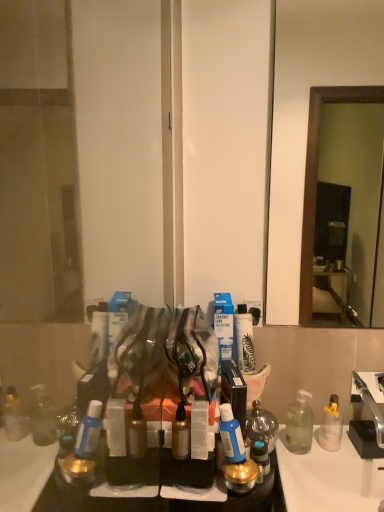
In order to face metallic gold toiletry at center, the 2th toiletry from the right, should I rotate leftwards or rightwards?

Turn right approximately 6.370 degrees to face it.

At what (x,y) coordinates should I click in order to perform the action: click on metallic gold spray can at center, the 1th toiletry from the left. Please return your answer as a coordinate pair (x, y). The width and height of the screenshot is (384, 512). Looking at the image, I should click on (180, 434).

Measure the distance between point (177, 443) and camera.

Point (177, 443) and camera are 95.40 centimeters apart from each other.

Find the location of a particular element. translucent glass jar at center, the 5th toiletry from the left is located at coordinates (262, 425).

Describe the element at coordinates (231, 435) in the screenshot. I see `blue glossy bottle at center, the third toiletry viewed from the left` at that location.

You are a GUI agent. You are given a task and a screenshot of the screen. Output one action in this format:
    pyautogui.click(x=<x>, y=<y>)
    Task: Click on the metallic gold toiletry at center, which is the 4th toiletry from left to right
    This screenshot has width=384, height=512.
    Given the screenshot: What is the action you would take?
    pyautogui.click(x=235, y=454)

Is blue glossy bottle at center, the 3th toiletry from the right, facing away from translucent glass jar at center, the 5th toiletry from the left?

blue glossy bottle at center, the 3th toiletry from the right, does not have its back to translucent glass jar at center, the 5th toiletry from the left.

Is blue glossy bottle at center, the third toiletry viewed from the left, positioned beyond the bounds of translucent glass jar at center, arranged as the 1th toiletry when viewed from the right?

Indeed, blue glossy bottle at center, the third toiletry viewed from the left, is completely outside translucent glass jar at center, arranged as the 1th toiletry when viewed from the right.

Is blue glossy bottle at center, the third toiletry viewed from the left, to the right of translucent glass jar at center, arranged as the 1th toiletry when viewed from the right, from the viewer's perspective?

No.

Between point (241, 459) and point (276, 426), which one is positioned in front?

The point (241, 459) is in front.

Are clear plastic soap dispenser at lower right and metallic gold toiletry at center, which is the 4th toiletry from left to right, far apart?

clear plastic soap dispenser at lower right is actually quite close to metallic gold toiletry at center, which is the 4th toiletry from left to right.

In the image, is clear plastic soap dispenser at lower right positioned in front of or behind metallic gold toiletry at center, which is the 4th toiletry from left to right?

clear plastic soap dispenser at lower right is positioned farther from the viewer than metallic gold toiletry at center, which is the 4th toiletry from left to right.

From the image's perspective, which one is positioned higher, clear plastic soap dispenser at lower right or metallic gold toiletry at center, which is the 4th toiletry from left to right?

clear plastic soap dispenser at lower right.

Is translucent glass jar at center, the 5th toiletry from the left, aimed at silver metallic faucet at right?

No, translucent glass jar at center, the 5th toiletry from the left, does not turn towards silver metallic faucet at right.

From the image's perspective, is translucent glass jar at center, the 5th toiletry from the left, on top of silver metallic faucet at right?

No, from the image's perspective, translucent glass jar at center, the 5th toiletry from the left, is not above silver metallic faucet at right.

Between translucent glass jar at center, arranged as the 1th toiletry when viewed from the right, and silver metallic faucet at right, which one has larger width?

silver metallic faucet at right.

Which is behind, translucent glass jar at center, arranged as the 1th toiletry when viewed from the right, or silver metallic faucet at right?

translucent glass jar at center, arranged as the 1th toiletry when viewed from the right.

Can you confirm if clear plastic soap dispenser at lower right is smaller than metallic gold spray can at center, the 5th toiletry viewed from the right?

No.

In the image, is clear plastic soap dispenser at lower right positioned in front of or behind metallic gold spray can at center, the 5th toiletry viewed from the right?

clear plastic soap dispenser at lower right is positioned farther from the viewer than metallic gold spray can at center, the 5th toiletry viewed from the right.

Consider the image. From a real-world perspective, who is located lower, clear plastic soap dispenser at lower right or metallic gold spray can at center, the 5th toiletry viewed from the right?

From a 3D spatial view, clear plastic soap dispenser at lower right is below.

Considering the points (303, 438) and (181, 410), which point is behind, point (303, 438) or point (181, 410)?

Point (303, 438)

Is point (172, 446) positioned after point (229, 454)?

Yes, point (172, 446) is behind point (229, 454).

Considering the positions of objects metallic gold spray can at center, the 5th toiletry viewed from the right, and metallic gold toiletry at center, the 2th toiletry from the right, in the image provided, who is more to the left, metallic gold spray can at center, the 5th toiletry viewed from the right, or metallic gold toiletry at center, the 2th toiletry from the right,?

Positioned to the left is metallic gold spray can at center, the 5th toiletry viewed from the right.

Starting from the metallic gold spray can at center, the 1th toiletry from the left, which toiletry is the 3rd one to the right? Please provide its 2D coordinates.

[(235, 454)]

Can you confirm if metallic gold spray can at center, the 1th toiletry from the left, is smaller than metallic gold toiletry at center, the 2th toiletry from the right?

Yes, metallic gold spray can at center, the 1th toiletry from the left, is smaller than metallic gold toiletry at center, the 2th toiletry from the right.

From a real-world perspective, which object stands above the other?

transparent plastic screen door at left, from a real-world perspective.

How different are the orientations of transparent plastic screen door at left and silver metallic faucet at right in degrees?

transparent plastic screen door at left and silver metallic faucet at right are facing 1.44 degrees away from each other.

From the image's perspective, which object appears higher, transparent plastic screen door at left or silver metallic faucet at right?

transparent plastic screen door at left.

In terms of size, does transparent plastic screen door at left appear bigger or smaller than silver metallic faucet at right?

In the image, transparent plastic screen door at left appears to be larger than silver metallic faucet at right.

Would you say metallic gold toiletry at center, the 2th toiletry from the right, contains translucent glass jar at center, the 5th toiletry from the left?

No.

Which is nearer, (x=236, y=470) or (x=253, y=407)?

The point (x=236, y=470) is closer.

In the scene shown: Is metallic gold toiletry at center, which is the 4th toiletry from left to right, thinner than translucent glass jar at center, arranged as the 1th toiletry when viewed from the right?

Incorrect, the width of metallic gold toiletry at center, which is the 4th toiletry from left to right, is not less than that of translucent glass jar at center, arranged as the 1th toiletry when viewed from the right.

In the image, is metallic gold toiletry at center, the 2th toiletry from the right, positioned in front of or behind translucent glass jar at center, the 5th toiletry from the left?

Clearly, metallic gold toiletry at center, the 2th toiletry from the right, is in front of translucent glass jar at center, the 5th toiletry from the left.

Where is `the 2nd toiletry counting from the left of the translucent glass jar at center, arranged as the 1th toiletry when viewed from the right`? This screenshot has height=512, width=384. the 2nd toiletry counting from the left of the translucent glass jar at center, arranged as the 1th toiletry when viewed from the right is located at coordinates (231, 435).

At what (x,y) coordinates should I click in order to perform the action: click on the 4th toiletry in front of the clear plastic soap dispenser at lower right. Please return your answer as a coordinate pair (x, y). The height and width of the screenshot is (512, 384). Looking at the image, I should click on (235, 454).

Which object lies nearer to the anchor point clear plastic soap dispenser at lower right, transparent plastic screen door at left or blue glossy bottle at center, the third toiletry viewed from the left?

Among the two, blue glossy bottle at center, the third toiletry viewed from the left, is located nearer to clear plastic soap dispenser at lower right.

When comparing their distances from silver metallic faucet at right, does clear plastic container at center, the 2th toiletry viewed from the left, or metallic gold spray can at center, the 5th toiletry viewed from the right, seem closer?

clear plastic container at center, the 2th toiletry viewed from the left, is positioned closer to the anchor silver metallic faucet at right.

From the image, which object appears to be nearer to clear plastic container at center, the 2th toiletry viewed from the left, clear plastic soap dispenser at lower right or translucent glass jar at center, arranged as the 1th toiletry when viewed from the right?

translucent glass jar at center, arranged as the 1th toiletry when viewed from the right, is closer to clear plastic container at center, the 2th toiletry viewed from the left.

Looking at this image, which object lies further to the anchor point metallic gold toiletry at center, which is the 4th toiletry from left to right, translucent glass jar at center, arranged as the 1th toiletry when viewed from the right, or metallic gold spray can at center, the 5th toiletry viewed from the right?

metallic gold spray can at center, the 5th toiletry viewed from the right, is positioned further to the anchor metallic gold toiletry at center, which is the 4th toiletry from left to right.

Based on their spatial positions, is translucent glass jar at center, arranged as the 1th toiletry when viewed from the right, or transparent plastic screen door at left closer to metallic gold spray can at center, the 5th toiletry viewed from the right?

translucent glass jar at center, arranged as the 1th toiletry when viewed from the right, is positioned closer to the anchor metallic gold spray can at center, the 5th toiletry viewed from the right.

Looking at the image, which one is located further to clear plastic soap dispenser at lower right, silver metallic faucet at right or clear plastic container at center, the 2th toiletry viewed from the left?

clear plastic container at center, the 2th toiletry viewed from the left, is positioned further to the anchor clear plastic soap dispenser at lower right.

Which object lies further to the anchor point clear plastic soap dispenser at lower right, clear plastic container at center, the 2th toiletry viewed from the left, or translucent glass jar at center, arranged as the 1th toiletry when viewed from the right?

clear plastic container at center, the 2th toiletry viewed from the left, is further to clear plastic soap dispenser at lower right.

When comparing their distances from translucent glass jar at center, arranged as the 1th toiletry when viewed from the right, does blue glossy bottle at center, the 3th toiletry from the right, or silver metallic faucet at right seem further?

Based on the image, silver metallic faucet at right appears to be further to translucent glass jar at center, arranged as the 1th toiletry when viewed from the right.

You are a GUI agent. You are given a task and a screenshot of the screen. Output one action in this format:
    pyautogui.click(x=<x>, y=<y>)
    Task: Click on the faucet located between transparent plastic screen door at left and clear plastic soap dispenser at lower right in the depth direction
    
    Given the screenshot: What is the action you would take?
    pyautogui.click(x=370, y=407)

You are a GUI agent. You are given a task and a screenshot of the screen. Output one action in this format:
    pyautogui.click(x=<x>, y=<y>)
    Task: Click on the toiletry located between transparent plastic screen door at left and metallic gold toiletry at center, the 2th toiletry from the right, in the depth direction
    The height and width of the screenshot is (512, 384).
    Given the screenshot: What is the action you would take?
    [x=199, y=430]

At what (x,y) coordinates should I click in order to perform the action: click on toiletry situated between metallic gold toiletry at center, the 2th toiletry from the right, and silver metallic faucet at right from left to right. Please return your answer as a coordinate pair (x, y). This screenshot has width=384, height=512. Looking at the image, I should click on (262, 425).

The width and height of the screenshot is (384, 512). In order to click on bottle located between clear plastic container at center, the 2th toiletry viewed from the left, and silver metallic faucet at right in the left-right direction in this screenshot , I will do `click(299, 424)`.